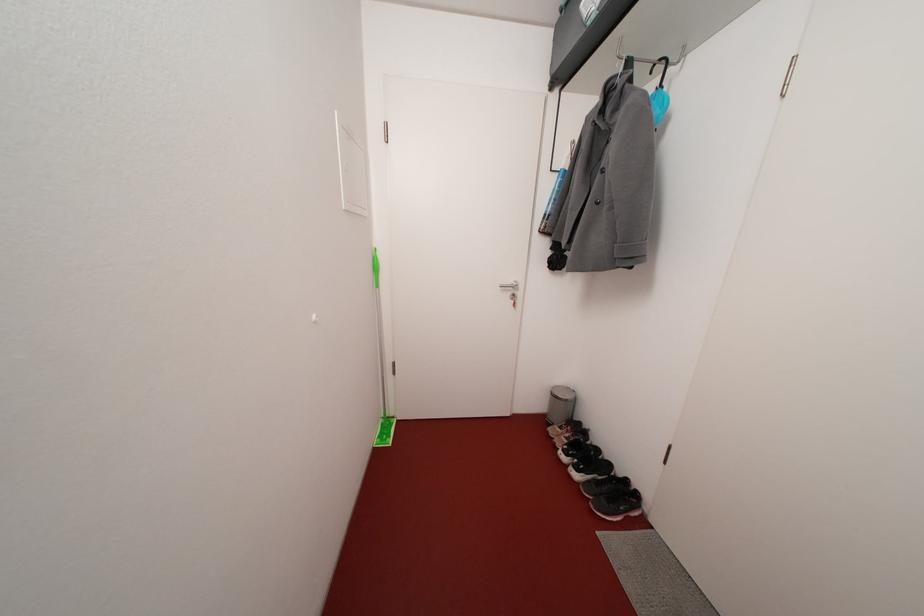
Describe the element at coordinates (565, 429) in the screenshot. The image size is (924, 616). I see `the black running shoe` at that location.